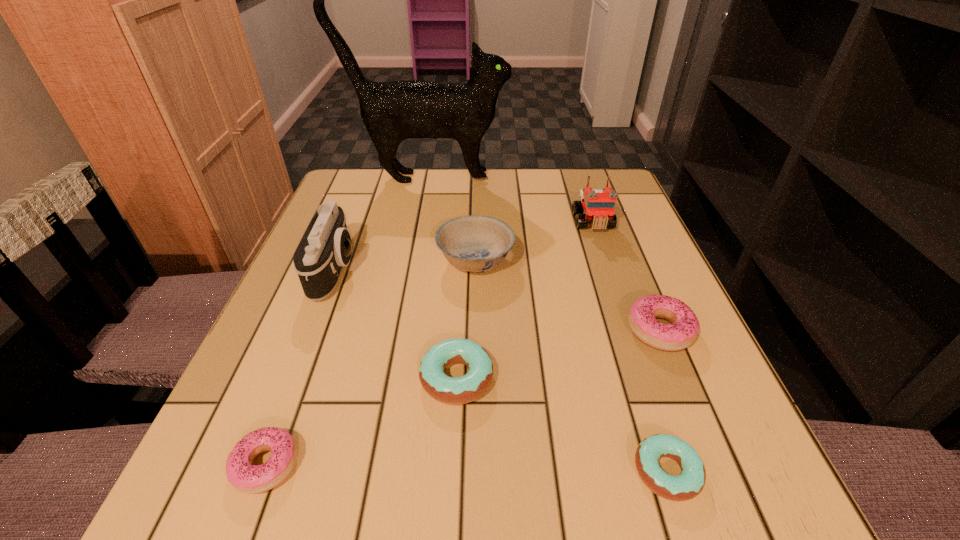
You are a GUI agent. You are given a task and a screenshot of the screen. Output one action in this format:
    pyautogui.click(x=<x>, y=<y>)
    Task: Click on the free spot between the cat and the camera
    
    Given the screenshot: What is the action you would take?
    pyautogui.click(x=382, y=224)

Locate an element on the screen. Image resolution: width=960 pixels, height=540 pixels. free space between the camera and the bigger blue doughnut is located at coordinates (396, 324).

Where is `free space between the fifth tallest object and the camera`? free space between the fifth tallest object and the camera is located at coordinates (497, 300).

I want to click on free spot between the red Lego and the bowl, so [x=534, y=241].

In order to click on empty space between the bowl and the leftmost doughnut in this screenshot , I will do `click(371, 362)`.

Find the location of `vacant space that is in between the left blue doughnut and the farthest object`. vacant space that is in between the left blue doughnut and the farthest object is located at coordinates (443, 278).

Image resolution: width=960 pixels, height=540 pixels. What are the coordinates of `vacant area between the left blue doughnut and the smaller blue doughnut` in the screenshot? It's located at (562, 424).

Where is `object that is the closest one to the bigger blue doughnut`? This screenshot has width=960, height=540. object that is the closest one to the bigger blue doughnut is located at coordinates (252, 479).

Select which object appears as the fifth closest to the farther blue doughnut. Please provide its 2D coordinates. Your answer should be formatted as a tuple, i.e. [(x, y)], where the tuple contains the x and y coordinates of a point satisfying the conditions above.

[(681, 333)]

Where is `doughnut that stands as the second closest to the smaller pink doughnut`? doughnut that stands as the second closest to the smaller pink doughnut is located at coordinates (690, 482).